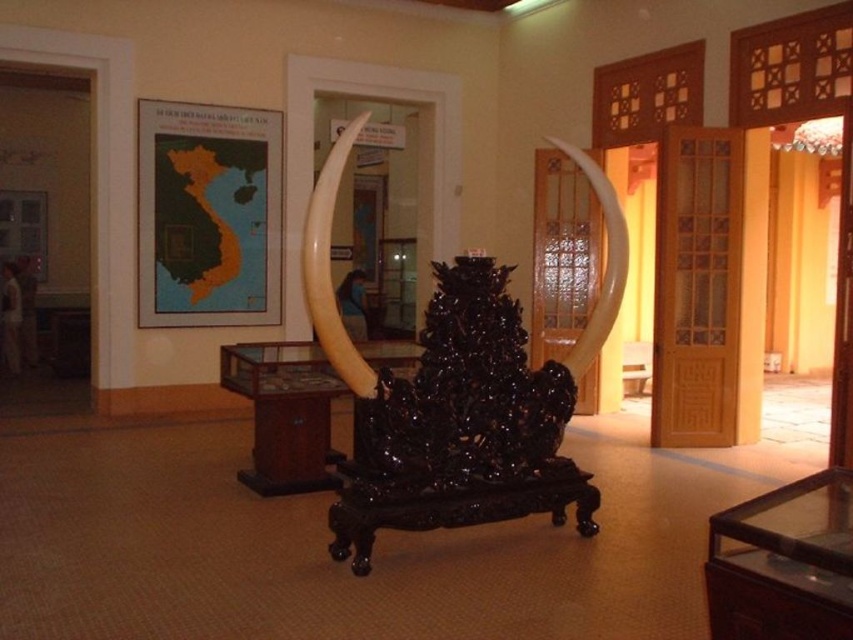
Question: Is black polished wood sculpture at center wider than ivory tusk at center?

Choices:
 (A) no
 (B) yes

Answer: (B)

Question: Which object is closer to the camera taking this photo?

Choices:
 (A) black polished wood sculpture at center
 (B) ivory tusk at center

Answer: (B)

Question: Is black polished wood sculpture at center smaller than ivory tusk at center?

Choices:
 (A) no
 (B) yes

Answer: (A)

Question: Can you confirm if black polished wood sculpture at center is wider than ivory tusk at center?

Choices:
 (A) no
 (B) yes

Answer: (B)

Question: Among these points, which one is nearest to the camera?

Choices:
 (A) (357, 385)
 (B) (531, 513)

Answer: (A)

Question: Which of the following is the closest to the observer?

Choices:
 (A) (547, 410)
 (B) (358, 387)

Answer: (B)